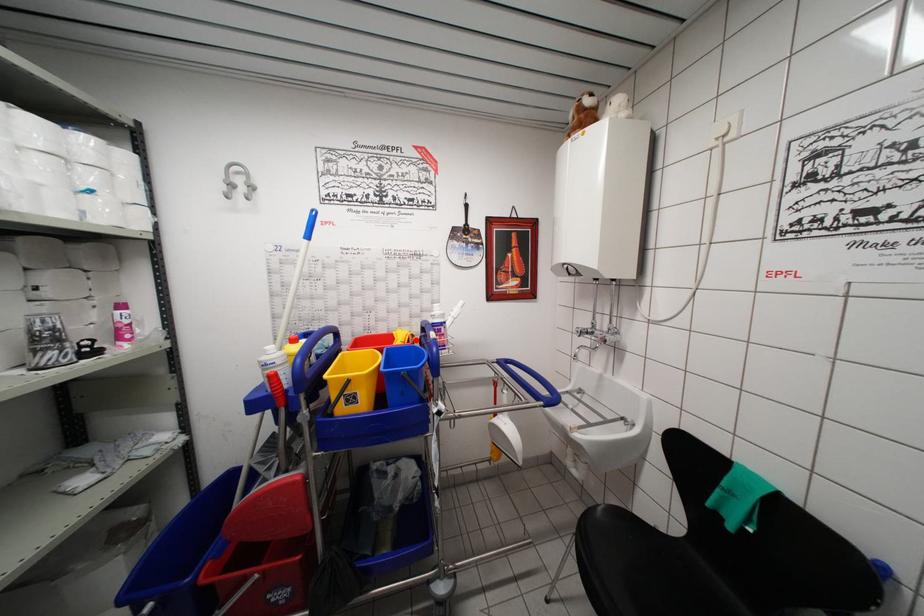
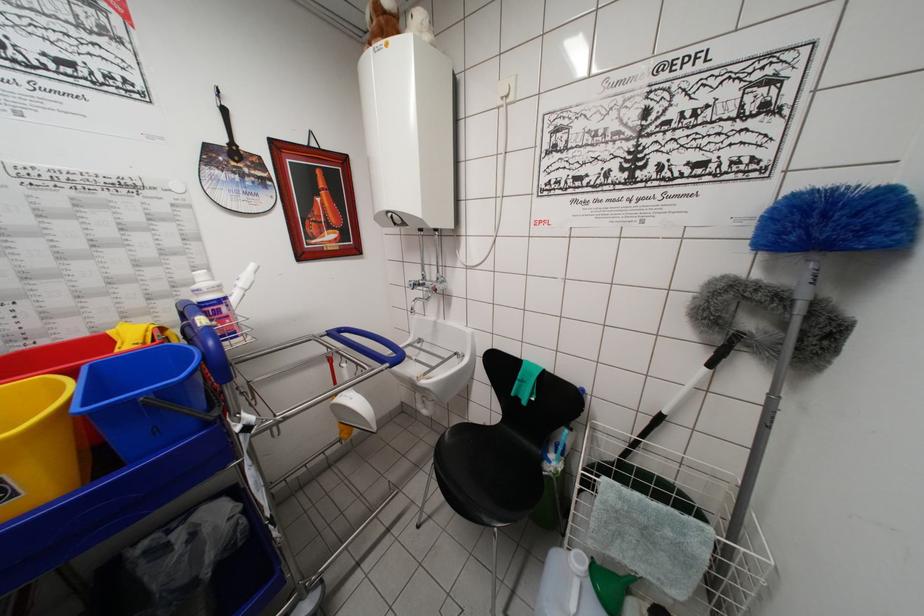
Locate, in the second image, the point that corresponds to the highlighted location in the first image.

(165, 333)